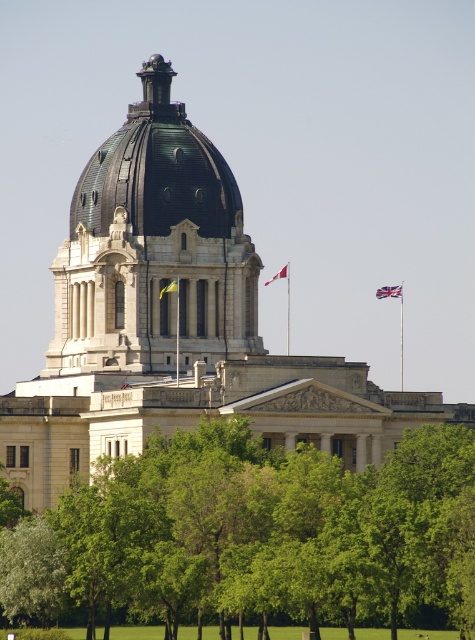
Who is positioned more to the right, green leafy tree at center or green copper dome at center?

Positioned to the right is green leafy tree at center.

This screenshot has height=640, width=475. What are the coordinates of `green leafy tree at center` in the screenshot? It's located at (256, 536).

Is green copper dome at center in front of green copper dome at upper center?

Yes, green copper dome at center is in front of green copper dome at upper center.

Which is above, green copper dome at center or green copper dome at upper center?

green copper dome at upper center

Is point (134, 268) closer to viewer compared to point (95, 216)?

Yes.

Find the location of a particular element. The width and height of the screenshot is (475, 640). green copper dome at center is located at coordinates point(153,248).

Does red fabric flag at upper center lie behind yellow fabric flag at center?

Yes, red fabric flag at upper center is further from the viewer.

Can you confirm if red fabric flag at upper center is positioned to the right of yellow fabric flag at center?

Yes, red fabric flag at upper center is to the right of yellow fabric flag at center.

Identify the location of red fabric flag at upper center. (279, 273).

The image size is (475, 640). I want to click on red fabric flag at upper center, so click(279, 273).